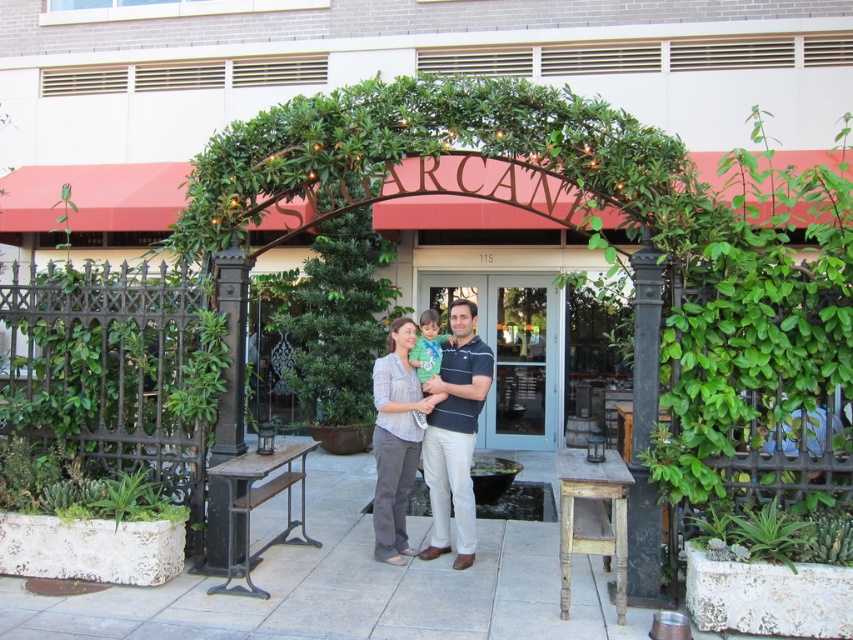
You are taking a photo of the scene in front of the SARCAZM archway. You want to ensure both the matte striped shirt at center and the green succulent at lower right are clearly visible. Which object should you position closer to the camera to avoid blurring due to depth of field limitations?

The matte striped shirt at center should be positioned closer to the camera because it is to the left of the green succulent at lower right, meaning it is already closer to the viewer. By keeping it near the foreground, it will remain in focus alongside the succulent.

From the picture: You are trying to place a wooden rustic stool at center in front of the matte striped shirt at center. Will the stool fit without overlapping the shirt?

The matte striped shirt at center might be wider than wooden rustic stool at center, so there is a possibility that the stool will not overlap the shirt. However, since the width comparison is uncertain, it is recommended to check the exact dimensions before placing the stool.